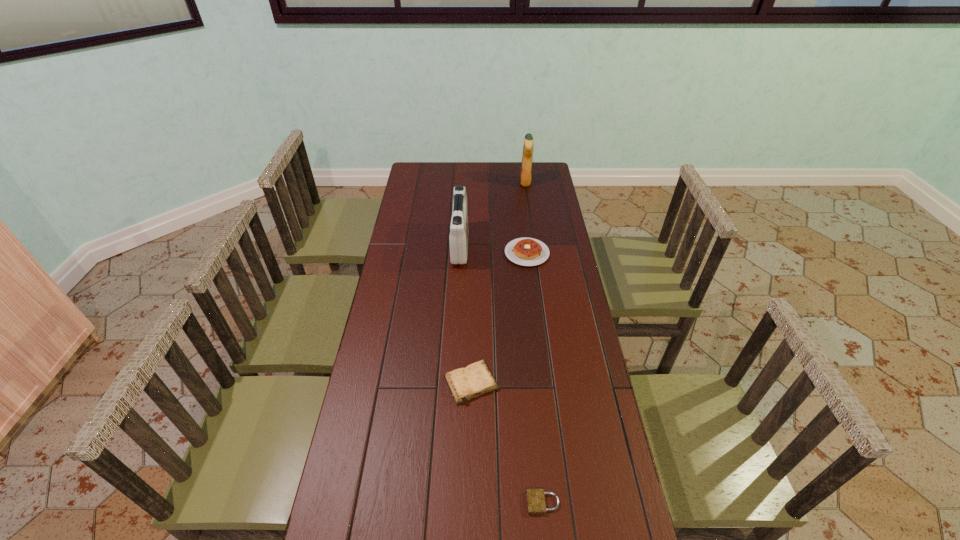
This screenshot has width=960, height=540. I want to click on vacant area that satisfies the following two spatial constraints: 1. on the back side of the pancake; 2. on the right side of the diary, so click(473, 253).

Find the location of a particular element. vacant space that satisfies the following two spatial constraints: 1. on the front side of the diary; 2. on the left side of the second tallest object is located at coordinates (452, 383).